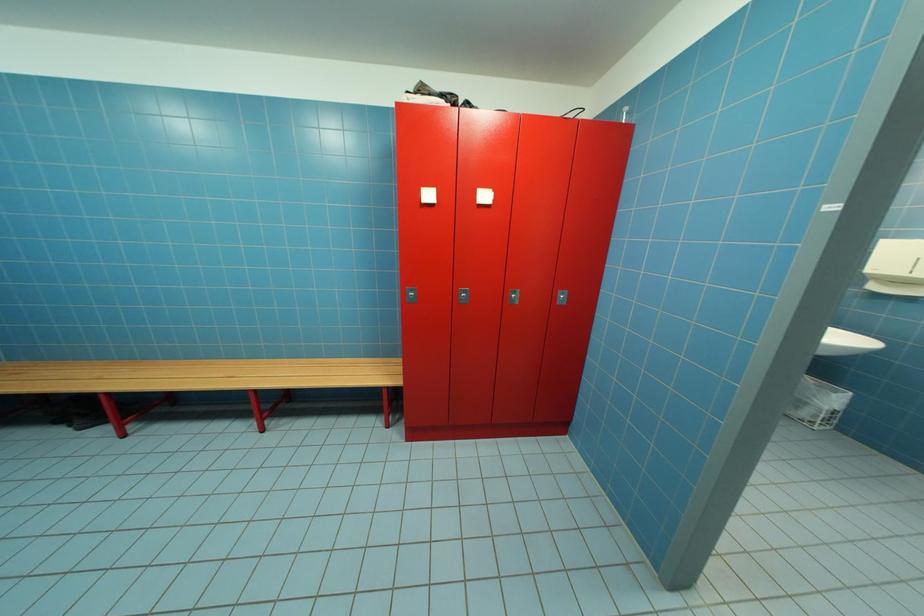
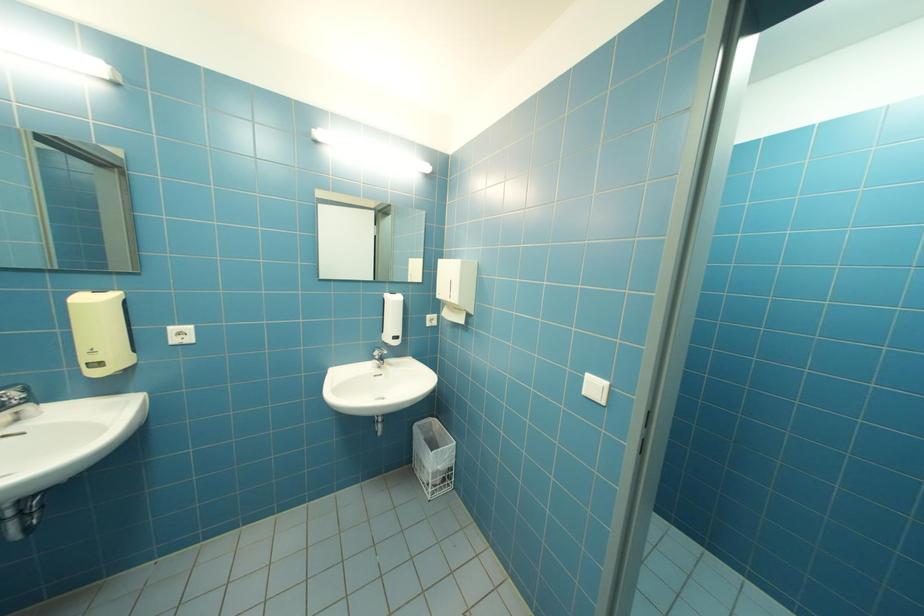
Question: Which direction would the cameraman need to move to produce the second image? Reply with the corresponding letter.

Choices:
 (A) Left
 (B) Right
 (C) Forward
 (D) Backward

Answer: (B)